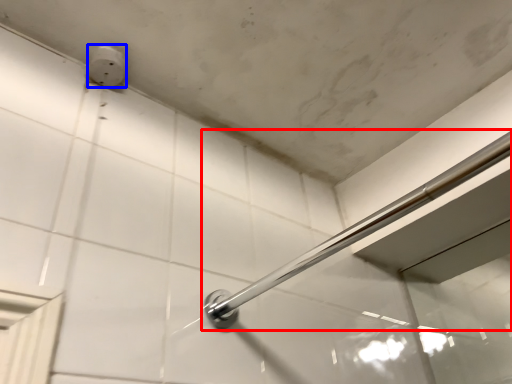
Question: Which of the following is the closest to the observer, door handle (highlighted by a red box) or electric outlet (highlighted by a blue box)?

Choices:
 (A) door handle
 (B) electric outlet

Answer: (A)